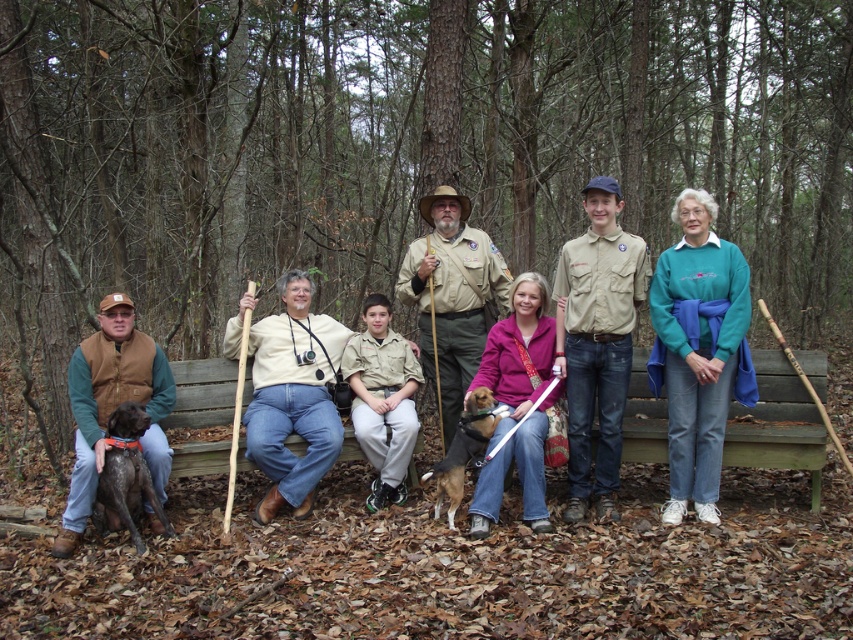
You are standing at the entrance of the wooded area and see the group on the wooden bench. If you want to approach the khaki uniform shirt at center, which direction should you head towards?

The khaki uniform shirt at center is located at point (596, 340), so you should head towards the center of the scene to reach it.

You are a photographer trying to capture a group photo of the adults on the wooden bench. You need to ensure both the teal fleece sweater at center and the light beige shirt at center are visible in the frame. Based on their positions, which adult should be positioned to the left to include both in the photo?

The light beige shirt at center should be positioned to the left since the teal fleece sweater at center is to the right of it, ensuring both are visible in the frame.

You are a photographer standing 2 meters away from the bench. You want to take a photo of the khaki uniform shirt at center and the khaki uniform at center. Can you fit both into the frame of your camera which has a maximum field of view of 1 meter?

The khaki uniform shirt at center and khaki uniform at center are 1.01 meters apart from each other. Since the distance between them exceeds the camera frame of 1 meter, you cannot fit both into the frame.